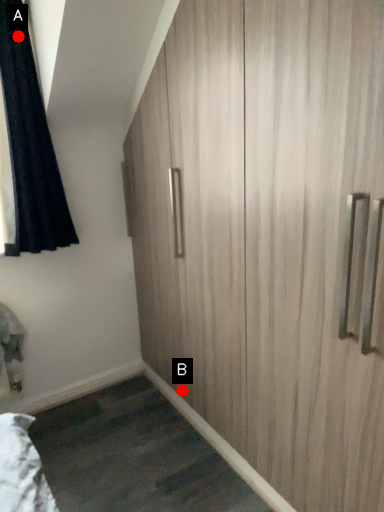
Question: Two points are circled on the image, labeled by A and B beside each circle. Which point appears closest to the camera in this image?

Choices:
 (A) A is closer
 (B) B is closer

Answer: (A)